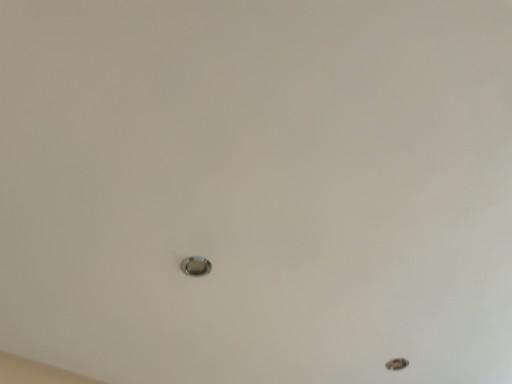
Question: Is point (205, 259) closer or farther from the camera than point (390, 364)?

Choices:
 (A) farther
 (B) closer

Answer: (B)

Question: From the image's perspective, is satin silver knob at center above or below metallic circular hole at lower right?

Choices:
 (A) below
 (B) above

Answer: (B)

Question: Is satin silver knob at center bigger or smaller than metallic circular hole at lower right?

Choices:
 (A) big
 (B) small

Answer: (B)

Question: Does point (403, 365) appear closer or farther from the camera than point (190, 269)?

Choices:
 (A) farther
 (B) closer

Answer: (A)

Question: From the image's perspective, is metallic circular hole at lower right positioned above or below satin silver knob at center?

Choices:
 (A) above
 (B) below

Answer: (B)

Question: In the image, is metallic circular hole at lower right positioned in front of or behind satin silver knob at center?

Choices:
 (A) behind
 (B) front

Answer: (A)

Question: In terms of width, does metallic circular hole at lower right look wider or thinner when compared to satin silver knob at center?

Choices:
 (A) wide
 (B) thin

Answer: (A)